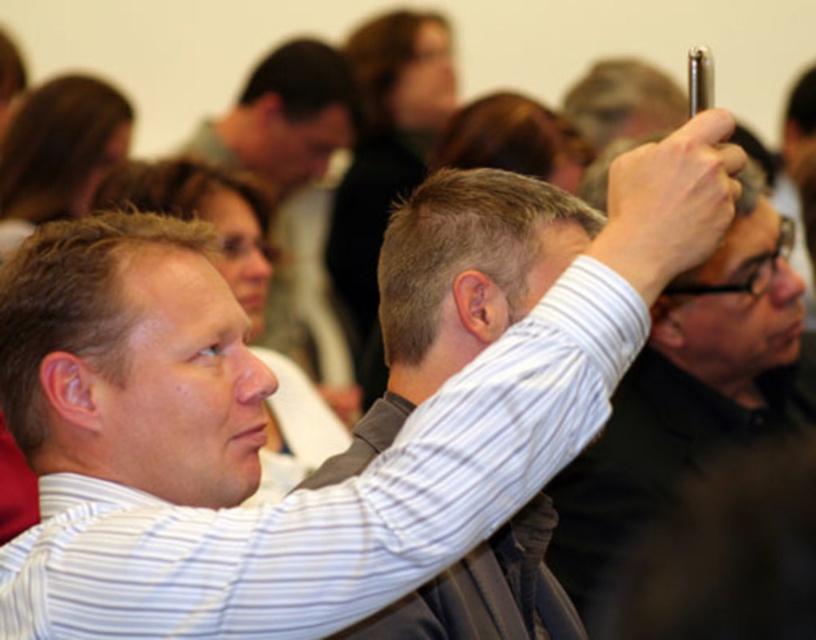
Is white striped shirt at upper center shorter than light brown hair at center?

No.

Can you confirm if white striped shirt at upper center is thinner than light brown hair at center?

In fact, white striped shirt at upper center might be wider than light brown hair at center.

Does point (744, 221) lie in front of point (38, 355)?

No, (744, 221) is further to viewer.

Image resolution: width=816 pixels, height=640 pixels. What are the coordinates of `white striped shirt at upper center` in the screenshot? It's located at (690, 396).

Does light brown hair at center come behind short blonde hair at upper center?

No.

Can you confirm if light brown hair at center is positioned above short blonde hair at upper center?

No.

Measure the distance between light brown hair at center and camera.

light brown hair at center is 3.67 feet from camera.

Where is `light brown hair at center`? The width and height of the screenshot is (816, 640). light brown hair at center is located at coordinates (73, 305).

Can you confirm if white striped shirt at upper center is thinner than short blonde hair at upper center?

Incorrect, white striped shirt at upper center's width is not less than short blonde hair at upper center's.

Who is higher up, white striped shirt at upper center or short blonde hair at upper center?

short blonde hair at upper center is above.

The height and width of the screenshot is (640, 816). I want to click on white striped shirt at upper center, so click(690, 396).